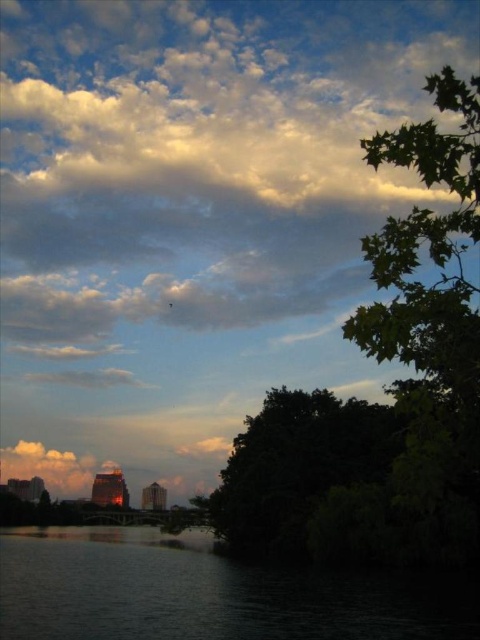
Question: Is green leafy tree at upper right above dark green leafy tree at lower right?

Choices:
 (A) no
 (B) yes

Answer: (B)

Question: Is dark water at lower left wider than dark green leafy tree at lower right?

Choices:
 (A) no
 (B) yes

Answer: (B)

Question: Which point appears closest to the camera in this image?

Choices:
 (A) (254, 609)
 (B) (346, 444)

Answer: (A)

Question: Which point appears farthest from the camera in this image?

Choices:
 (A) click(x=236, y=468)
 (B) click(x=394, y=464)
 (C) click(x=459, y=621)

Answer: (A)

Question: Which point appears closest to the camera in this image?

Choices:
 (A) (427, 390)
 (B) (40, 627)

Answer: (A)

Question: Does dark water at lower left appear over dark green leafy tree at lower right?

Choices:
 (A) yes
 (B) no

Answer: (B)